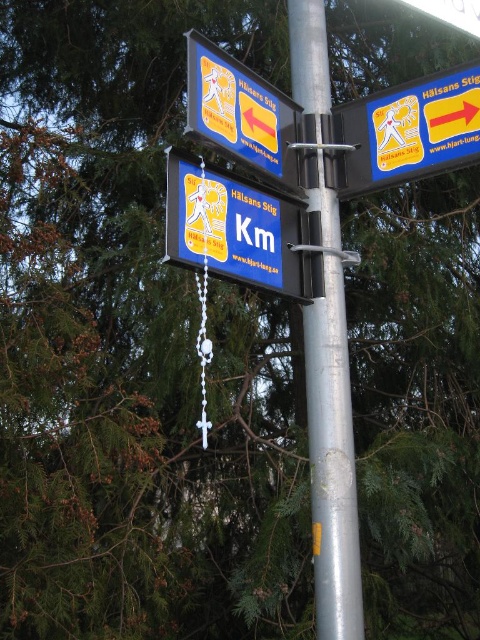
You are standing in front of the metal pole with three directional signs. You notice a specific point marked at coordinates (233, 228). Which object is this point located on?

The point at (233, 228) is located on the blue plastic sign at center.

You are a hiker trying to determine which sign to follow for the shortest distance to Health Path. You see a blue plastic sign at center and a blue plastic sign at upper right. Which sign has a smaller width that might indicate it shows the nearest route?

The blue plastic sign at center has a smaller width than the blue plastic sign at upper right, so it might indicate the nearest route.